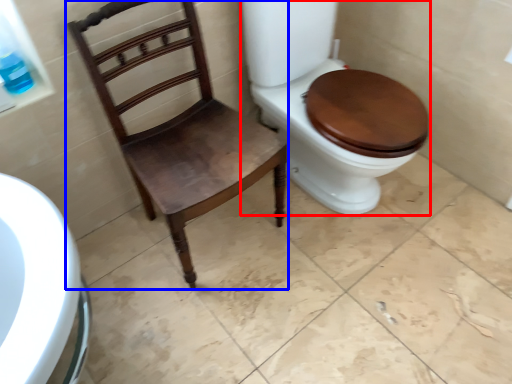
Question: Which point is closer to the camera, toilet (highlighted by a red box) or chair (highlighted by a blue box)?

Choices:
 (A) toilet
 (B) chair

Answer: (B)